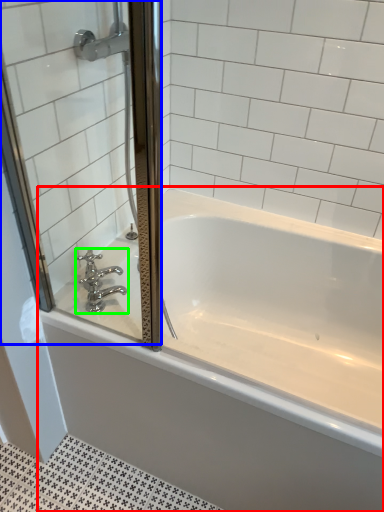
Question: Estimate the real-world distances between objects in this image. Which object is closer to bathtub (highlighted by a red box), screen door (highlighted by a blue box) or tap (highlighted by a green box)?

Choices:
 (A) screen door
 (B) tap

Answer: (A)